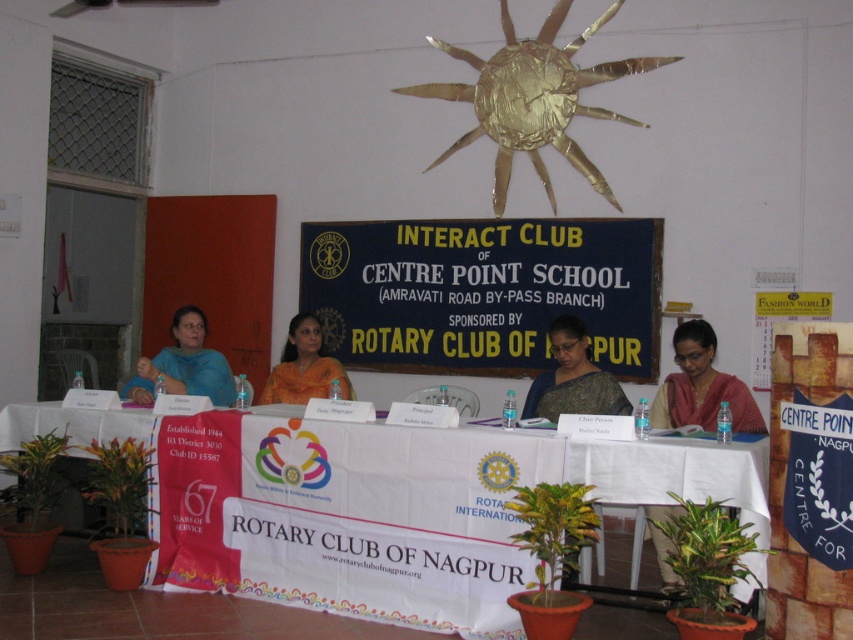
You are a photographer standing at a certain distance from the table. You need to capture a clear closeup shot of the matte black saree at center. Given that the camera you are using has a minimum focusing distance of 10 feet, will you be able to take the photo without moving closer?

The matte black saree at center is 15.78 feet away from the camera. Since the minimum focusing distance is 10 feet, the camera can focus on objects beyond 10 feet. Therefore, you can take the clear closeup shot without moving closer.